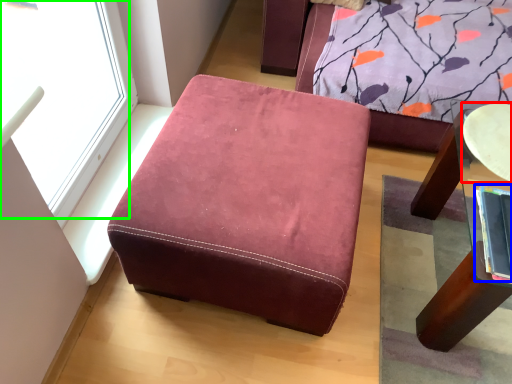
Question: Considering the real-world distances, which object is closest to round table (highlighted by a red box)? book (highlighted by a blue box) or window (highlighted by a green box).

Choices:
 (A) book
 (B) window

Answer: (A)